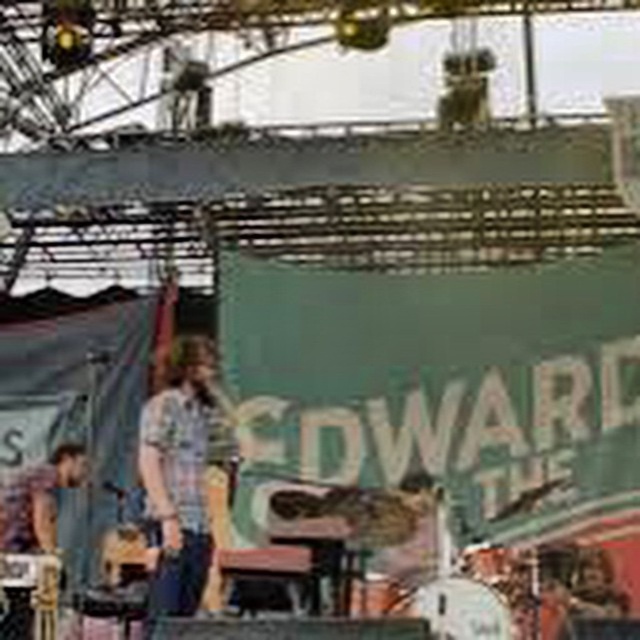
Is the position of plaid shirt at center less distant than that of matte gray shirt at lower left?

No, plaid shirt at center is behind matte gray shirt at lower left.

Can you confirm if plaid shirt at center is positioned to the right of matte gray shirt at lower left?

Indeed, plaid shirt at center is positioned on the right side of matte gray shirt at lower left.

What do you see at coordinates (188, 480) in the screenshot? I see `plaid shirt at center` at bounding box center [188, 480].

Locate an element on the screen. Image resolution: width=640 pixels, height=640 pixels. plaid shirt at center is located at coordinates (188, 480).